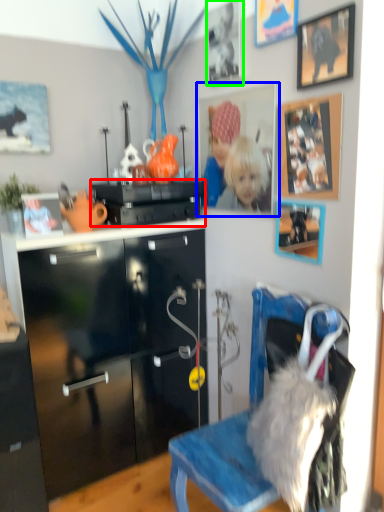
Question: Estimate the real-world distances between objects in this image. Which object is closer to appliance (highlighted by a red box), picture frame (highlighted by a blue box) or picture frame (highlighted by a green box)?

Choices:
 (A) picture frame
 (B) picture frame

Answer: (A)